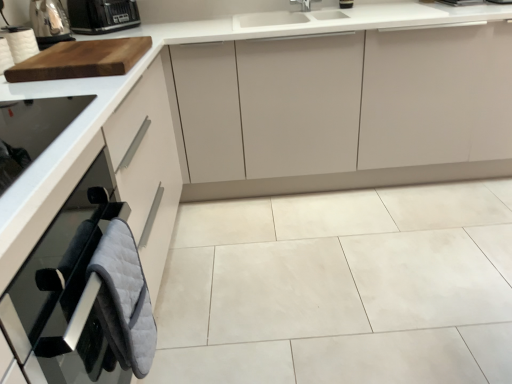
Image resolution: width=512 pixels, height=384 pixels. What do you see at coordinates (20, 42) in the screenshot? I see `white paper towel at upper left` at bounding box center [20, 42].

The height and width of the screenshot is (384, 512). What do you see at coordinates (341, 288) in the screenshot?
I see `white ceramic tile at center` at bounding box center [341, 288].

This screenshot has height=384, width=512. What do you see at coordinates (349, 110) in the screenshot? I see `matte white cabinet at center, which is the 2th cabinetry in front-to-back order` at bounding box center [349, 110].

Where is `white paper towel at upper left`? white paper towel at upper left is located at coordinates (20, 42).

Does white ceramic tile at center have a lesser height compared to metallic silver toaster at upper left?

Indeed, white ceramic tile at center has a lesser height compared to metallic silver toaster at upper left.

Is white ceramic tile at center oriented towards metallic silver toaster at upper left?

No, white ceramic tile at center is not facing towards metallic silver toaster at upper left.

Between white ceramic tile at center and metallic silver toaster at upper left, which one is positioned behind?

metallic silver toaster at upper left is more distant.

Is white ceramic tile at center located outside metallic silver toaster at upper left?

white ceramic tile at center lies outside metallic silver toaster at upper left's area.

Find the location of a particular element. The width and height of the screenshot is (512, 384). home appliance below the white paper towel at upper left (from a real-world perspective) is located at coordinates (32, 130).

Is white paper towel at upper left completely or partially inside black glass oven at left?

No.

Is black glass oven at left facing away from white paper towel at upper left?

No.

From the image's perspective, is black glass oven at left located above white paper towel at upper left?

No.

Is black glass oven at left positioned far away from metallic silver toaster at upper left?

black glass oven at left is actually quite close to metallic silver toaster at upper left.

Is black glass oven at left not inside metallic silver toaster at upper left?

Absolutely, black glass oven at left is external to metallic silver toaster at upper left.

Can you tell me how much black glass oven at left and metallic silver toaster at upper left differ in facing direction?

The facing directions of black glass oven at left and metallic silver toaster at upper left are 2.5 degrees apart.

Is black glass oven at left thinner than metallic silver toaster at upper left?

No.

Is the depth of matte white cabinet at center, the 1th cabinetry viewed from the back, greater than that of black plastic toaster at upper left?

No, the depth of matte white cabinet at center, the 1th cabinetry viewed from the back, is less than that of black plastic toaster at upper left.

Can we say matte white cabinet at center, marked as the 2th cabinetry in a bottom-to-top arrangement, lies outside black plastic toaster at upper left?

Indeed, matte white cabinet at center, marked as the 2th cabinetry in a bottom-to-top arrangement, is completely outside black plastic toaster at upper left.

From a real-world perspective, which is physically below, matte white cabinet at center, positioned as the first cabinetry in top-to-bottom order, or black plastic toaster at upper left?

matte white cabinet at center, positioned as the first cabinetry in top-to-bottom order, from a real-world perspective.

Is black plastic toaster at upper left smaller than white paper towel at upper left?

Incorrect, black plastic toaster at upper left is not smaller in size than white paper towel at upper left.

How much distance is there between black plastic toaster at upper left and white paper towel at upper left?

A distance of 20.68 inches exists between black plastic toaster at upper left and white paper towel at upper left.

Considering the positions of point (71, 5) and point (22, 31), is point (71, 5) closer or farther from the camera than point (22, 31)?

Point (71, 5) is farther from the camera than point (22, 31).

Is black plastic toaster at upper left facing away from white paper towel at upper left?

That's not correct — black plastic toaster at upper left is not looking away from white paper towel at upper left.

In the scene shown: Measure the distance between white ceramic tile at center and gray quilted oven mitts at lower left, placed as the 2th cabinetry when sorted from back to front.

white ceramic tile at center and gray quilted oven mitts at lower left, placed as the 2th cabinetry when sorted from back to front, are 28.73 inches apart.

Would you say white ceramic tile at center is inside or outside gray quilted oven mitts at lower left, the 1th cabinetry positioned from the front?

The correct answer is: outside.

Is white ceramic tile at center turned away from gray quilted oven mitts at lower left, placed as the 2th cabinetry when sorted from back to front?

No.

Which is behind, white ceramic tile at center or gray quilted oven mitts at lower left, acting as the first cabinetry starting from the bottom?

Positioned behind is white ceramic tile at center.

Is white paper towel at upper left looking in the opposite direction of black glass oven at left?

white paper towel at upper left does not have its back to black glass oven at left.

From a real-world perspective, is white paper towel at upper left beneath black glass oven at left?

Incorrect, from a real-world perspective, white paper towel at upper left is higher than black glass oven at left.

From the picture: Can you confirm if white paper towel at upper left is thinner than black glass oven at left?

Indeed, white paper towel at upper left has a lesser width compared to black glass oven at left.

Is white paper towel at upper left beside black glass oven at left?

There is a gap between white paper towel at upper left and black glass oven at left.

Identify the location of ceramic tile on the right of metallic silver toaster at upper left. (341, 288).

What are the coordinates of `home appliance below the white paper towel at upper left (from the image's perspective)` in the screenshot? It's located at (32, 130).

Which object lies further to the anchor point black glass oven at left, metallic silver toaster at upper left or white paper towel at upper left?

Based on the image, metallic silver toaster at upper left appears to be further to black glass oven at left.

Based on their spatial positions, is gray quilted oven mitts at lower left, the 1th cabinetry positioned from the front, or metallic silver toaster at upper left further from white ceramic tile at center?

metallic silver toaster at upper left is positioned further to the anchor white ceramic tile at center.

From the image, which object appears to be nearer to white ceramic tile at center, metallic silver toaster at upper left or gray quilted oven mitts at lower left?

Based on the image, gray quilted oven mitts at lower left appears to be nearer to white ceramic tile at center.

Considering their positions, is white ceramic tile at center positioned further to matte white cabinet at center, positioned as the first cabinetry in top-to-bottom order, than gray quilted oven mitts at lower left, placed as the 2th cabinetry when sorted from back to front?

gray quilted oven mitts at lower left, placed as the 2th cabinetry when sorted from back to front, is positioned further to the anchor matte white cabinet at center, positioned as the first cabinetry in top-to-bottom order.

When comparing their distances from black glass oven at left, does white ceramic tile at center or gray quilted oven mitts at lower left seem closer?

The object closer to black glass oven at left is gray quilted oven mitts at lower left.

Based on their spatial positions, is black glass oven at left or matte white cabinet at center, which is the 2th cabinetry in front-to-back order, further from metallic silver toaster at upper left?

matte white cabinet at center, which is the 2th cabinetry in front-to-back order, lies further to metallic silver toaster at upper left than the other object.

Looking at the image, which one is located closer to black plastic toaster at upper left, white ceramic tile at center or metallic silver toaster at upper left?

Based on the image, metallic silver toaster at upper left appears to be nearer to black plastic toaster at upper left.

Looking at the image, which one is located closer to metallic silver toaster at upper left, black glass oven at left or white paper towel at upper left?

white paper towel at upper left is positioned closer to the anchor metallic silver toaster at upper left.

Where is `ceramic tile positioned between gray quilted oven mitts at lower left and matte white cabinet at center, positioned as the first cabinetry in top-to-bottom order, from near to far`? The image size is (512, 384). ceramic tile positioned between gray quilted oven mitts at lower left and matte white cabinet at center, positioned as the first cabinetry in top-to-bottom order, from near to far is located at coordinates (341, 288).

Where is `material between white paper towel at upper left and matte white cabinet at center, marked as the 2th cabinetry in a bottom-to-top arrangement, from left to right`? Image resolution: width=512 pixels, height=384 pixels. material between white paper towel at upper left and matte white cabinet at center, marked as the 2th cabinetry in a bottom-to-top arrangement, from left to right is located at coordinates (124, 299).

Image resolution: width=512 pixels, height=384 pixels. I want to click on home appliance that lies between white paper towel at upper left and gray quilted oven mitts at lower left from top to bottom, so click(x=32, y=130).

The height and width of the screenshot is (384, 512). Identify the location of material between gray quilted oven mitts at lower left, arranged as the second cabinetry when viewed from the top, and matte white cabinet at center, the 1th cabinetry viewed from the back, in the front-back direction. (124, 299).